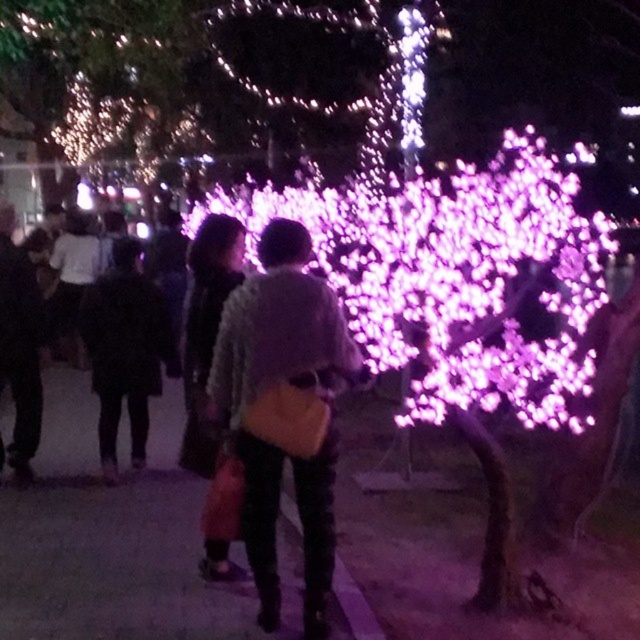
You are an artist trying to sketch this scene. You want to ensure the proportions between the matte yellow bag at center and the illuminated plastic tree at upper left are accurate. Which object should you draw smaller in your sketch?

The matte yellow bag at center should be drawn smaller than the illuminated plastic tree at upper left because it occupies less space in the image.

From the picture: You are standing in the middle of the pathway and want to take a photo of both the purple illuminated tree at center and the illuminated plastic tree at upper left. Which tree should you position closer to the camera to ensure both are in the frame?

Since the purple illuminated tree at center is taller than the illuminated plastic tree at upper left, you should position the purple illuminated tree at center closer to the camera to ensure both are in the frame.

You are a photographer trying to capture the scene with a camera that has a limited focus range. The camera can only focus on objects taller than 1 meter. Given that the matte yellow bag at center and the illuminated plastic tree at upper left are in your frame, which object will the camera focus on?

The matte yellow bag at center is taller than the illuminated plastic tree at upper left. Since the camera focuses on objects taller than 1 meter, it will focus on the matte yellow bag at center.